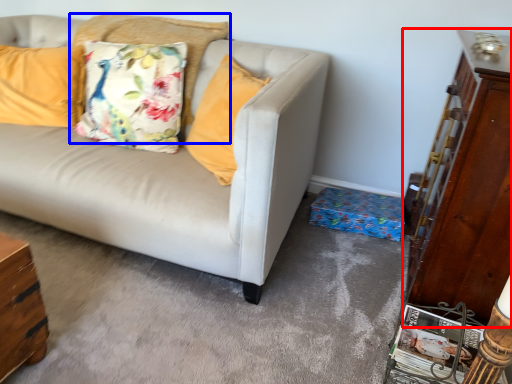
Question: Which object appears closest to the camera in this image, dresser (highlighted by a red box) or pillow (highlighted by a blue box)?

Choices:
 (A) dresser
 (B) pillow

Answer: (A)